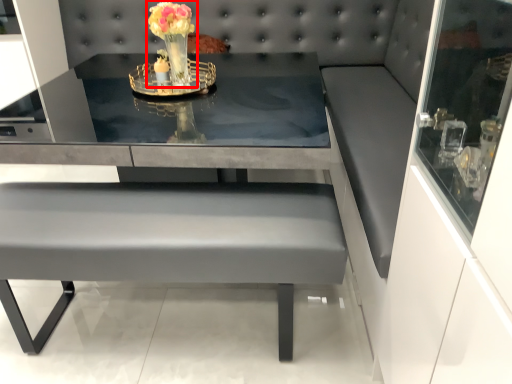
Question: Considering the relative positions of floral arrangement (annotated by the red box) and table in the image provided, where is floral arrangement (annotated by the red box) located with respect to the staircase?

Choices:
 (A) right
 (B) left

Answer: (B)